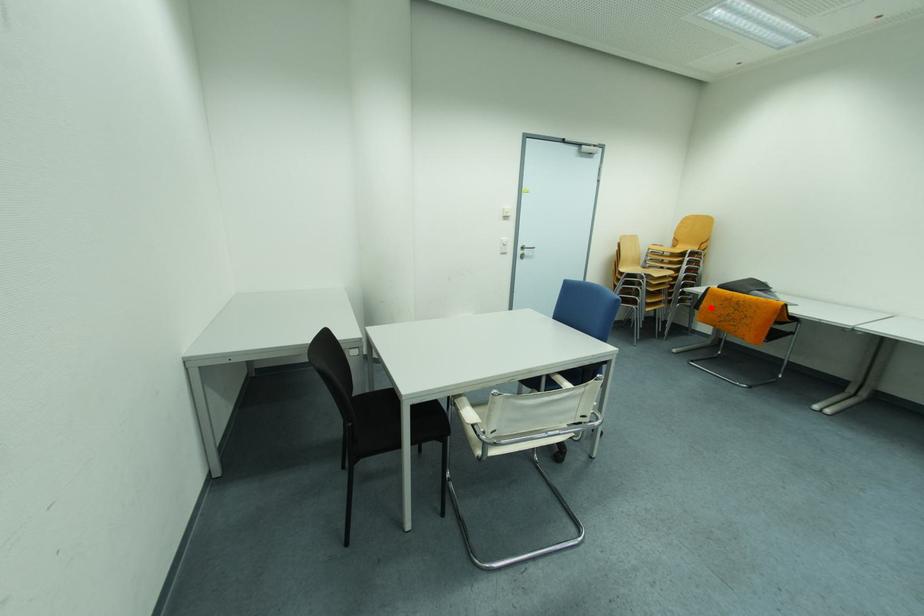
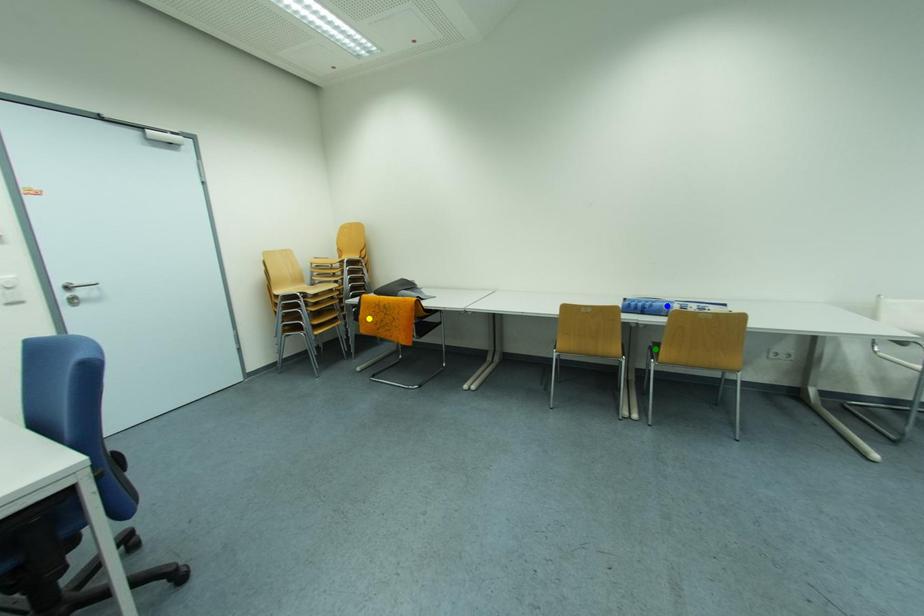
Question: I am providing you with two images of the same scene from different viewpoints. A red point is marked on the first image. You are given multiple points on the second image. In image 2, which mark is for the same physical point as the one in image 1?

Choices:
 (A) green point
 (B) blue point
 (C) yellow point

Answer: (C)